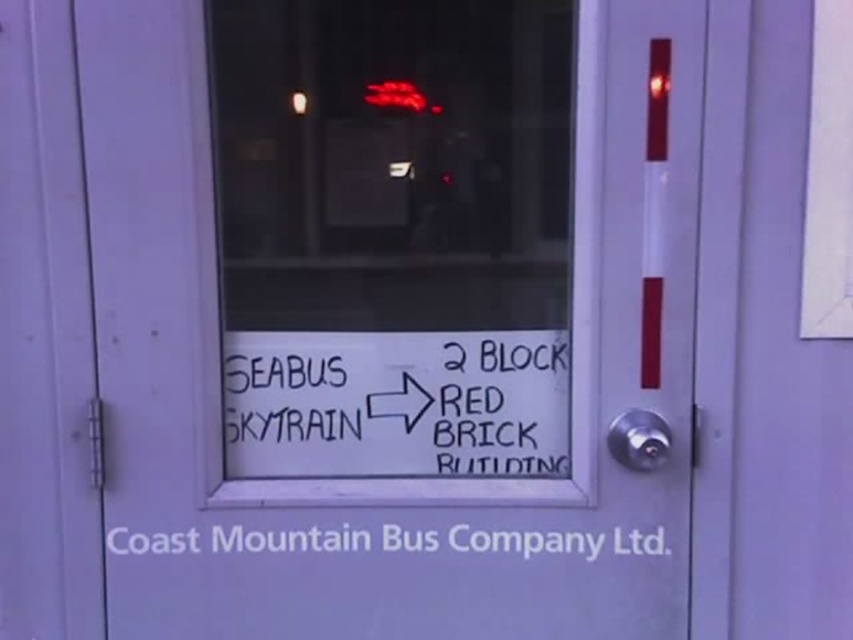
Question: Which object appears farthest from the camera in this image?

Choices:
 (A) white paper at center
 (B) black marker sign at center
 (C) white paper sign at center
 (D) transparent glass door at center

Answer: (B)

Question: Is transparent glass door at center above white paper sign at center?

Choices:
 (A) no
 (B) yes

Answer: (A)

Question: Which point is closer to the camera?

Choices:
 (A) white paper sign at center
 (B) black marker sign at center

Answer: (A)

Question: Which object is positioned closest to the white paper sign at center?

Choices:
 (A) white paper at center
 (B) black marker sign at center
 (C) transparent glass door at center

Answer: (C)

Question: Is transparent glass door at center wider than black marker sign at center?

Choices:
 (A) yes
 (B) no

Answer: (A)

Question: Is transparent glass door at center wider than white paper sign at center?

Choices:
 (A) yes
 (B) no

Answer: (A)